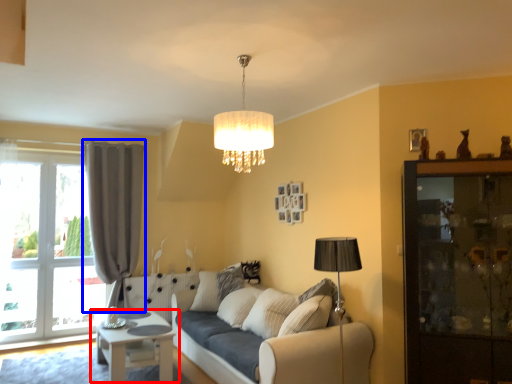
Question: Among these objects, which one is farthest to the camera, table (highlighted by a red box) or curtain (highlighted by a blue box)?

Choices:
 (A) table
 (B) curtain

Answer: (B)